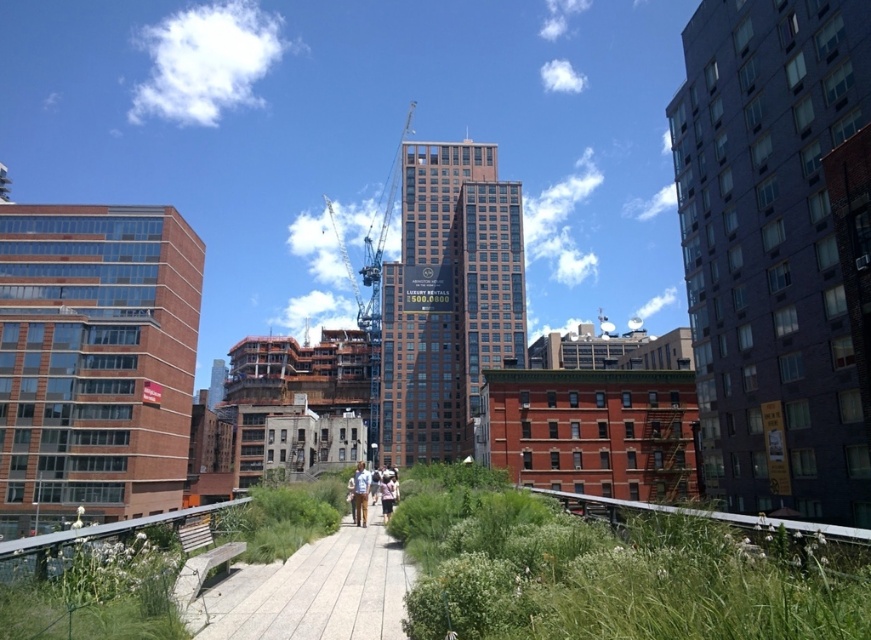
Is point (395, 624) more distant than point (382, 512)?

That is False.

Is wooden at center to the left of light brown leather jacket at center from the viewer's perspective?

Yes, wooden at center is to the left of light brown leather jacket at center.

Is point (268, 611) closer to viewer compared to point (389, 512)?

Yes.

Find the location of a particular element. wooden at center is located at coordinates (316, 589).

Who is lower down, wooden at center or matte white shirt at center?

matte white shirt at center

Who is more forward, (308,611) or (356,483)?

Point (308,611)

Who is more forward, (355, 545) or (392, 474)?

Point (355, 545) is more forward.

Find the location of a particular element. wooden at center is located at coordinates (316, 589).

Based on the photo, is green grass at lower center further to the viewer compared to light blue shirt at center?

No, it is not.

Can you confirm if green grass at lower center is positioned above light blue shirt at center?

Yes, green grass at lower center is above light blue shirt at center.

This screenshot has width=871, height=640. What do you see at coordinates (608, 572) in the screenshot? I see `green grass at lower center` at bounding box center [608, 572].

Where is `green grass at lower center`? The image size is (871, 640). green grass at lower center is located at coordinates (608, 572).